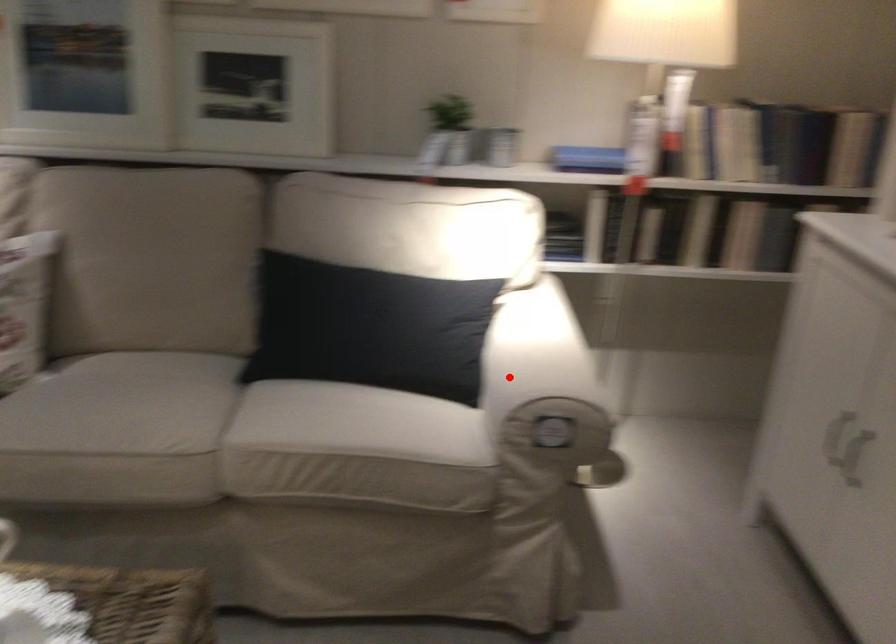
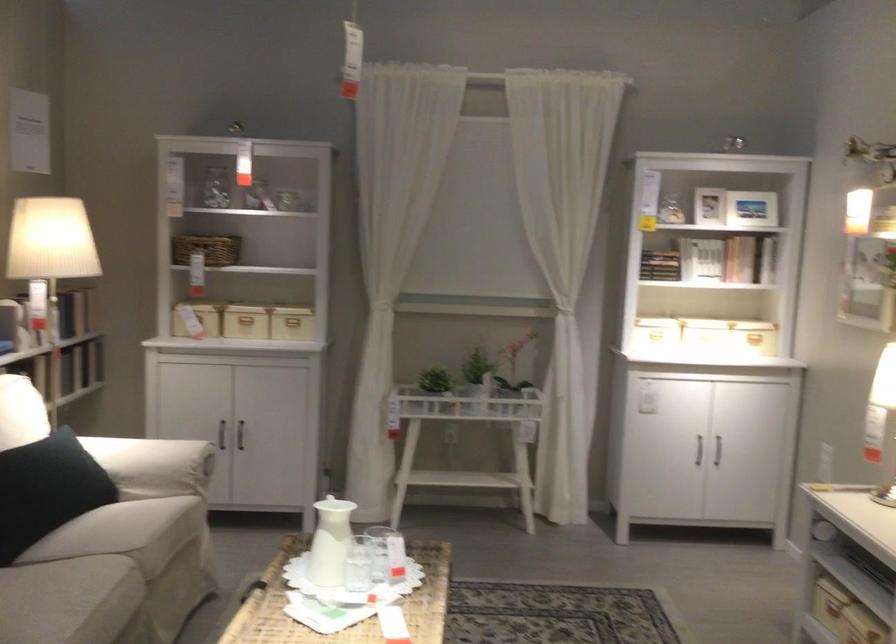
Question: I am providing you with two images of the same scene from different viewpoints. In image1, a red point is highlighted. Considering the same 3D point in image2, which of the following is correct?

Choices:
 (A) It is closer
 (B) It is farther

Answer: (B)